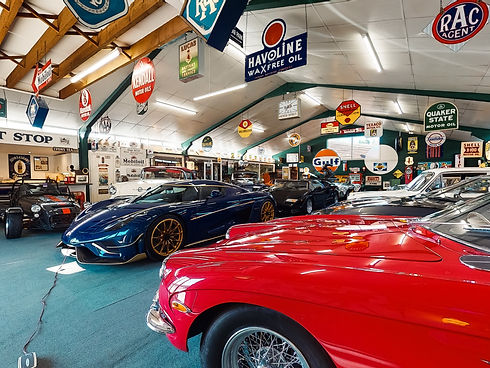
This screenshot has height=368, width=490. I want to click on cable, so click(x=34, y=329).